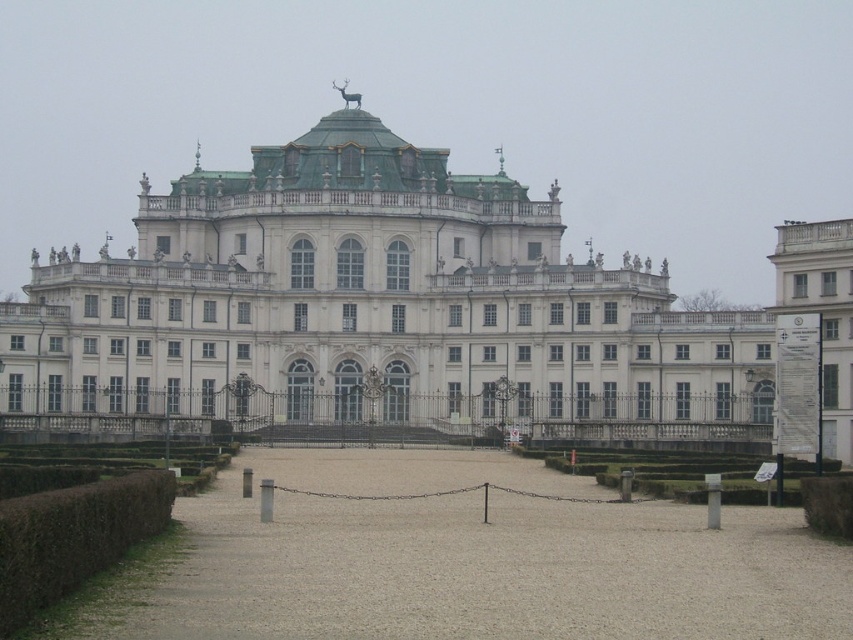
Consider the image. You are a visitor approaching the grand classical building and want to enter through the main entrance. You see the brown gravel path at center and the green leafy hedge at lower left. Which object is closer to the building?

The brown gravel path at center is positioned under green leafy hedge at lower left, meaning the hedge is closer to the building than the path.